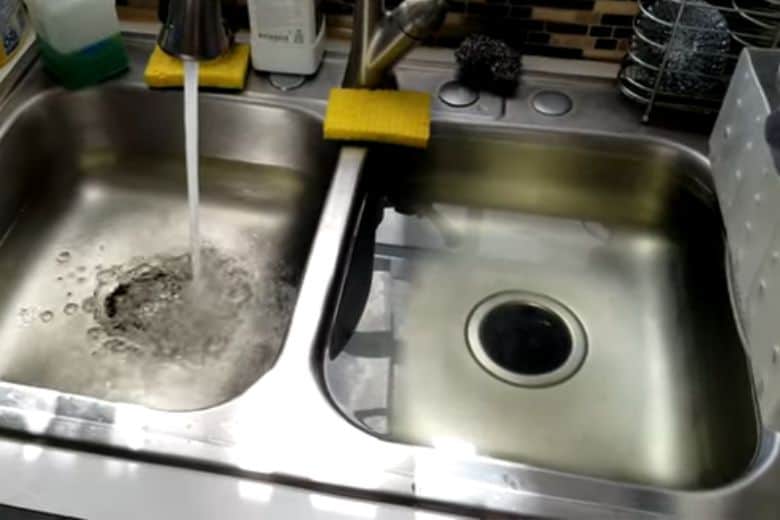
Where is `white water pouring into left sink`? The height and width of the screenshot is (520, 780). white water pouring into left sink is located at coordinates (193, 100).